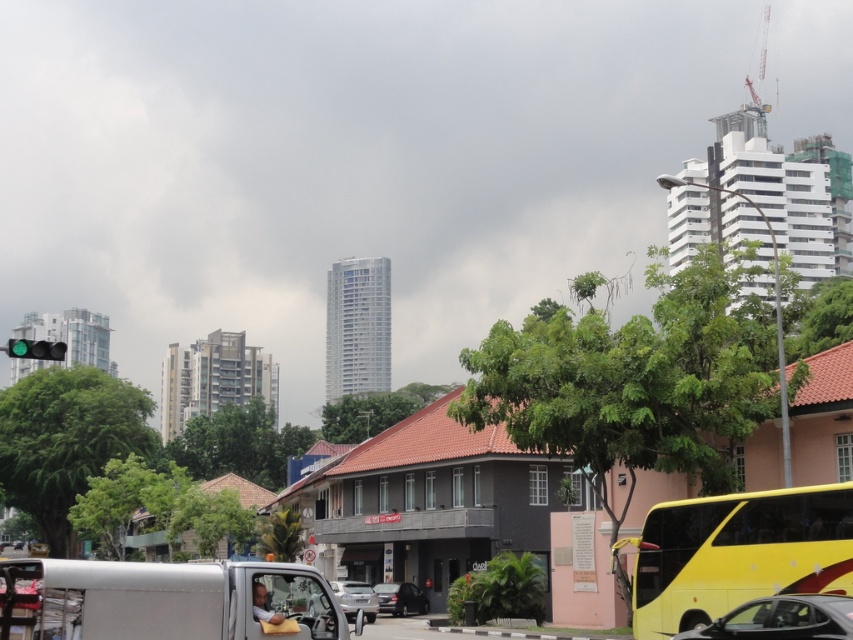
You are a pedestrian standing on the sidewalk near the shiny black car at center and the silver metallic car at center. Which car is positioned higher relative to the other?

The shiny black car at center is below the silver metallic car at center, so the silver metallic car at center is positioned higher.